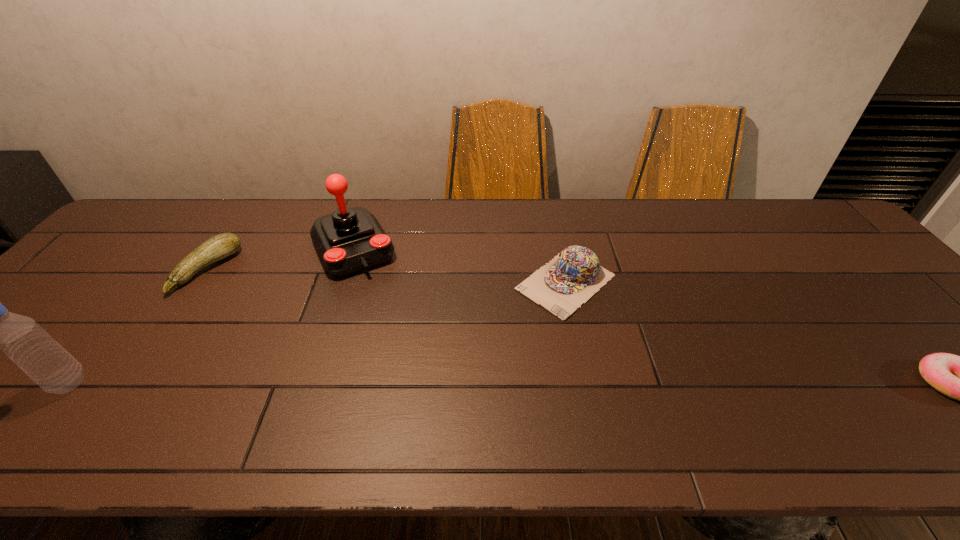
The height and width of the screenshot is (540, 960). In the image, there is a desktop. Identify the location of vacant space at the far right corner. (817, 226).

Where is `vacant space that is in between the leftmost object and the zucchini`? The height and width of the screenshot is (540, 960). vacant space that is in between the leftmost object and the zucchini is located at coordinates (138, 327).

Where is `unoccupied area between the leftmost object and the fourth object from left to right`? This screenshot has width=960, height=540. unoccupied area between the leftmost object and the fourth object from left to right is located at coordinates (317, 333).

Identify the location of free space between the bottle and the second object from left to right. The width and height of the screenshot is (960, 540). (138, 327).

This screenshot has width=960, height=540. In order to click on empty location between the fourth object from right to left and the fourth object from left to right in this screenshot , I will do `click(386, 276)`.

Image resolution: width=960 pixels, height=540 pixels. What are the coordinates of `empty space that is in between the second object from left to right and the bottle` in the screenshot? It's located at (138, 327).

Find the location of a particular element. empty space that is in between the second object from right to left and the fourth object from right to left is located at coordinates click(386, 276).

Locate an element on the screen. This screenshot has height=540, width=960. empty space that is in between the joystick and the cap is located at coordinates (459, 265).

This screenshot has width=960, height=540. Identify the location of the closest object to the third object from left to right. (221, 246).

Find the location of a particular element. The height and width of the screenshot is (540, 960). the closest object to the third object from right to left is located at coordinates (221, 246).